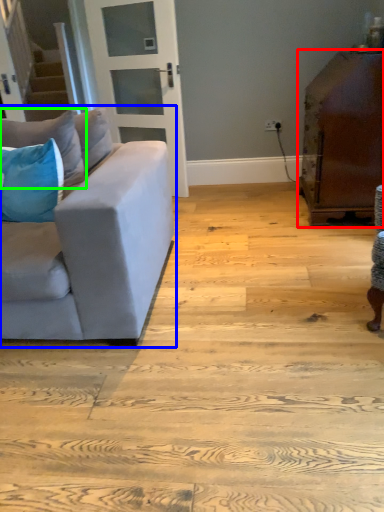
Question: Which object is the farthest from table (highlighted by a red box)? Choose among these: studio couch (highlighted by a blue box) or pillow (highlighted by a green box).

Choices:
 (A) studio couch
 (B) pillow

Answer: (B)